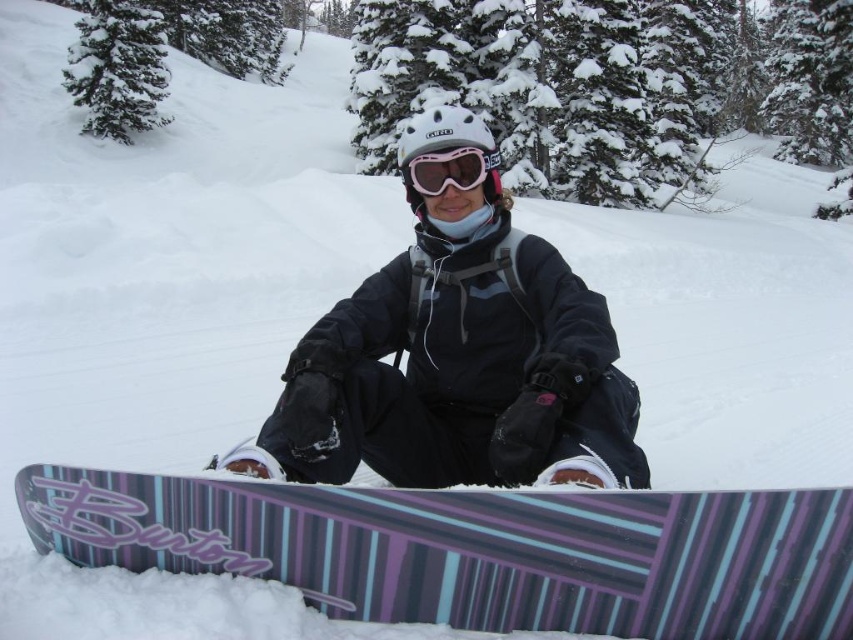
Based on the photo, the scene shows a snowboarder and goggles. Which object is taller between the black matte snowboarder at center and the pink reflective goggles at center?

The black matte snowboarder at center is much taller than the pink reflective goggles at center.

You are a photographer trying to capture both the purple striped snowboard at lower center and the black matte snowboarder at center in a single shot. Based on their sizes in the image, which object would you need to focus on first to ensure both are in frame?

The purple striped snowboard at lower center occupies less space than the black matte snowboarder at center, so you should focus on positioning the black matte snowboarder at center first since it takes up more space and will require more attention to fit properly in the frame.

Based on the photo, you are a photographer trying to capture the snowboarder from a specific angle. You want to ensure that both points, point (605, 465) and point (422, 156), are clearly visible in your shot. Which point will appear closer to the camera in the final photograph?

Point (605, 465) is closer to the viewer than point (422, 156), so it will appear closer to the camera in the photograph.